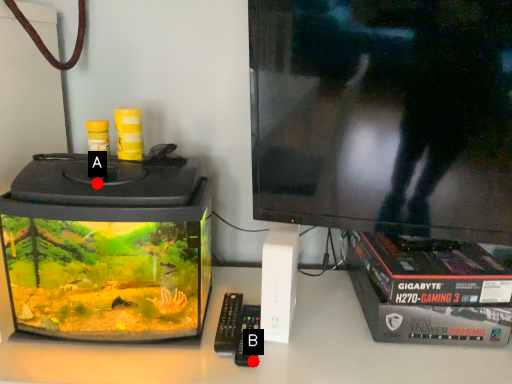
Question: Two points are circled on the image, labeled by A and B beside each circle. Which point is further to the camera?

Choices:
 (A) A is further
 (B) B is further

Answer: (B)